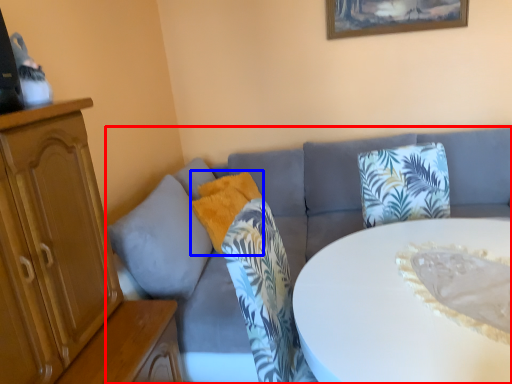
Question: Which object is closer to the camera taking this photo, studio couch (highlighted by a red box) or pillow (highlighted by a blue box)?

Choices:
 (A) studio couch
 (B) pillow

Answer: (A)